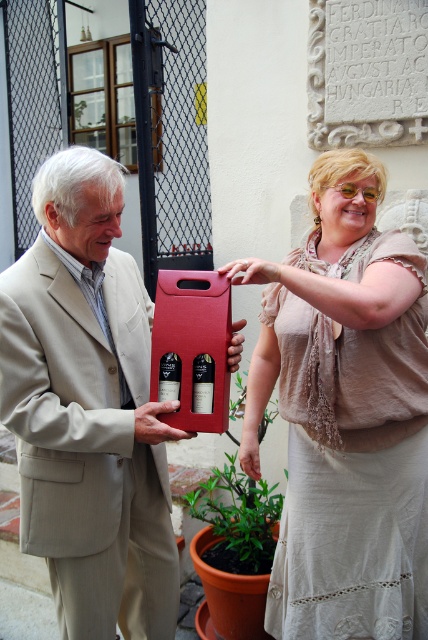
You are organizing a photoshoot and need to ensure that the matte beige dress at center and the green leafy plant at center do not overlap in the final image. Based on their positions and sizes, can you determine if there is enough space between them to prevent overlapping?

The matte beige dress at center might be wider than the green leafy plant at center, so there may not be enough space between them to prevent overlapping. Adjust their positions to ensure proper spacing.

You are a photographer setting up for a photoshoot in the courtyard. You need to arrange a matte beige dress at center and a matte black wine at center so that the dress is on the right side of the wine. Based on the current setup, is the dress already positioned correctly?

The matte beige dress at center is positioned on the right side of matte black wine at center, so yes, the dress is already correctly placed to the right of the wine.